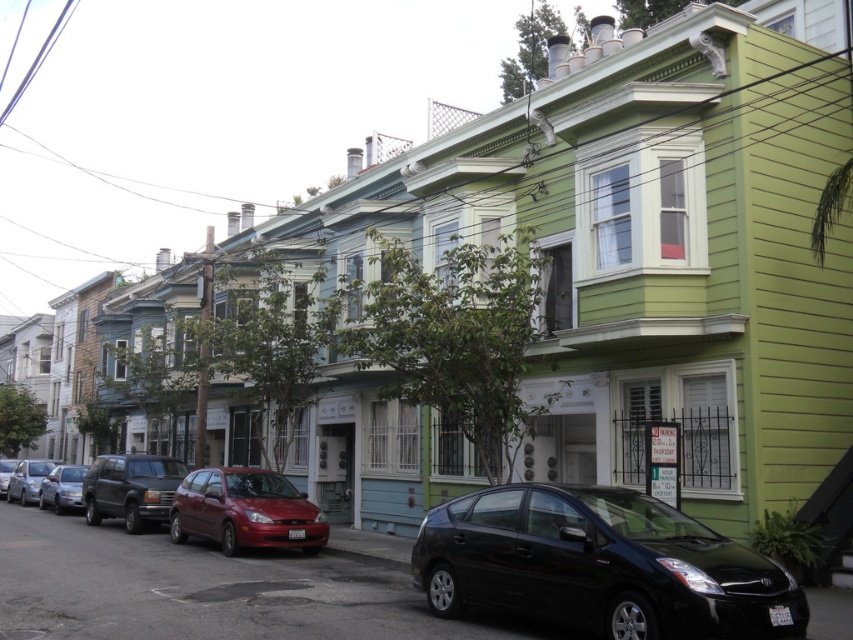
Question: Which point is farther to the camera?

Choices:
 (A) (15, 480)
 (B) (189, 525)

Answer: (A)

Question: Which of the following is the farthest from the observer?

Choices:
 (A) shiny red hatchback at center
 (B) metallic red sedan at center

Answer: (B)

Question: Estimate the real-world distances between objects in this image. Which object is closer to the metallic red sedan at center?

Choices:
 (A) metallic silver sedan at center-left
 (B) black glossy car at lower right
 (C) matte black suv at center-left

Answer: (A)

Question: Is black glossy car at lower right below shiny red hatchback at center?

Choices:
 (A) yes
 (B) no

Answer: (B)

Question: Does metallic silver sedan at left appear under metallic red sedan at center?

Choices:
 (A) no
 (B) yes

Answer: (B)

Question: Considering the relative positions of shiny red hatchback at center and metallic silver sedan at center-left in the image provided, where is shiny red hatchback at center located with respect to metallic silver sedan at center-left?

Choices:
 (A) below
 (B) above

Answer: (B)